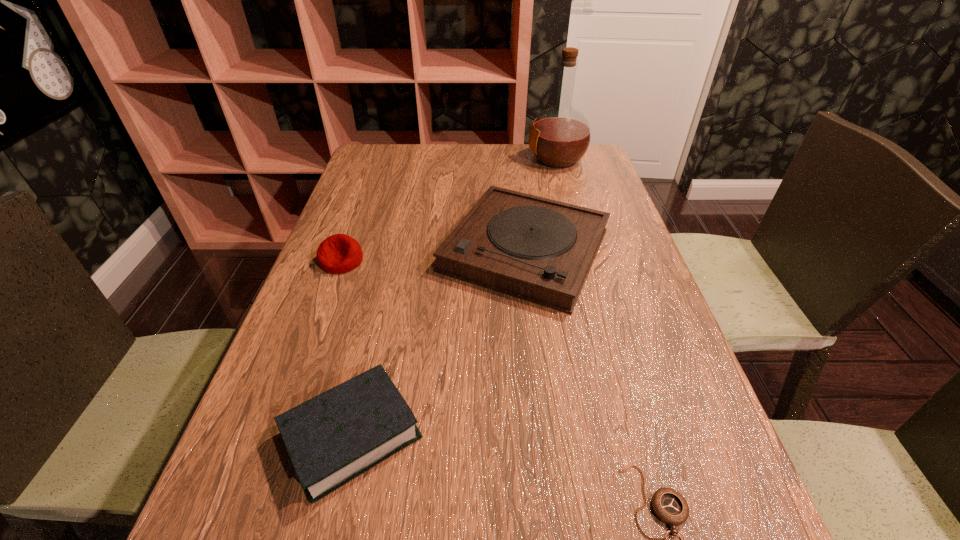
You are a GUI agent. You are given a task and a screenshot of the screen. Output one action in this format:
    pyautogui.click(x=<x>, y=<y>)
    Task: Click on the vacant space located on the back of the second shortest object
    Image resolution: width=960 pixels, height=540 pixels.
    Given the screenshot: What is the action you would take?
    pyautogui.click(x=378, y=319)

The image size is (960, 540). Identify the location of object that is positioned at the far edge. coord(560,136).

I want to click on beanbag positioned at the left edge, so click(339, 253).

You are a GUI agent. You are given a task and a screenshot of the screen. Output one action in this format:
    pyautogui.click(x=<x>, y=<y>)
    Task: Click on the Bible at the left edge
    
    Given the screenshot: What is the action you would take?
    pyautogui.click(x=332, y=438)

Find the location of a particular element. The width and height of the screenshot is (960, 540). liquor at the right edge is located at coordinates (560, 136).

At what (x,y) coordinates should I click in order to perform the action: click on phonograph record situated at the right edge. Please return your answer as a coordinate pair (x, y). Looking at the image, I should click on (536, 249).

This screenshot has width=960, height=540. I want to click on object at the far right corner, so click(x=560, y=136).

The height and width of the screenshot is (540, 960). Find the location of `vacant space at the far edge`. vacant space at the far edge is located at coordinates 475,156.

Find the location of a particular element. free space at the right edge is located at coordinates (652, 392).

You are a GUI agent. You are given a task and a screenshot of the screen. Output one action in this format:
    pyautogui.click(x=<x>, y=<y>)
    Task: Click on the free spot at the far left corner of the desktop
    The height and width of the screenshot is (540, 960).
    Given the screenshot: What is the action you would take?
    pyautogui.click(x=386, y=153)